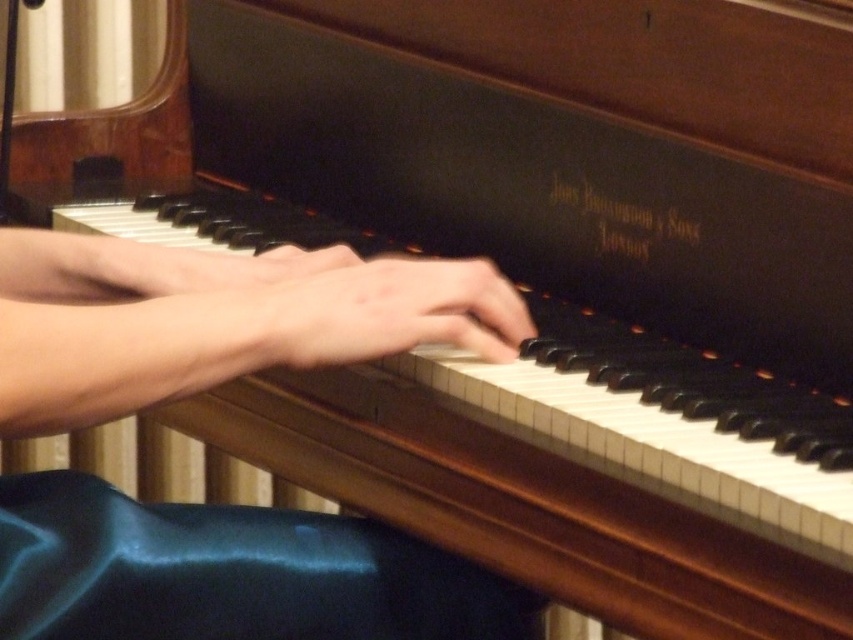
Between smooth skin hands at center and smooth skin hand at center, which one is positioned higher?

smooth skin hands at center is above.

Can you confirm if smooth skin hands at center is thinner than smooth skin hand at center?

Incorrect, smooth skin hands at center's width is not less than smooth skin hand at center's.

Between point (70, 273) and point (422, 320), which one is positioned in front?

Point (422, 320) is in front.

At what (x,y) coordinates should I click in order to perform the action: click on smooth skin hands at center. Please return your answer as a coordinate pair (x, y). Looking at the image, I should click on (215, 320).